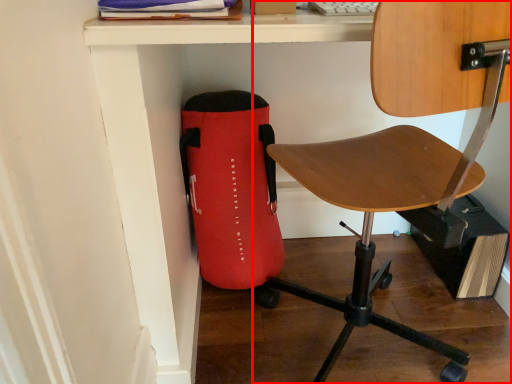
Question: In this image, where is chair (annotated by the red box) located relative to bag?

Choices:
 (A) right
 (B) left

Answer: (A)